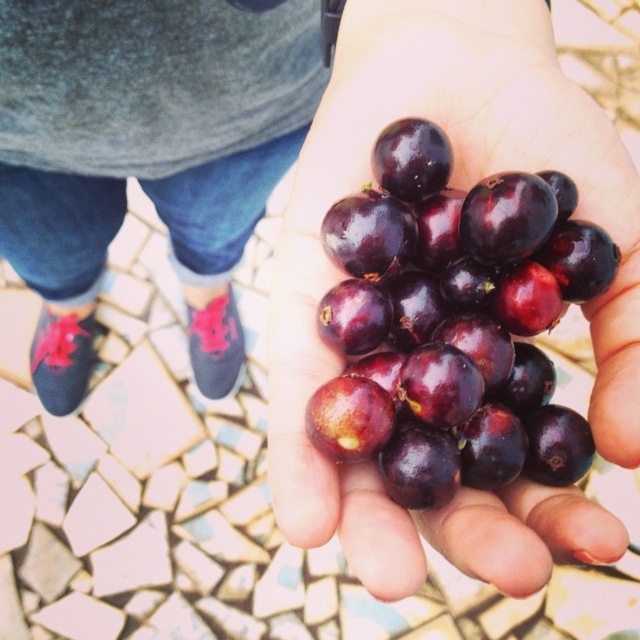
Is point (284, 380) positioned in front of point (64, 161)?

Yes, point (284, 380) is closer to viewer.

Where is `shiny dark purple grapes at center`? shiny dark purple grapes at center is located at coordinates (461, 188).

Does point (620, 413) come farther from viewer compared to point (212, 148)?

That is False.

Locate an element on the screen. This screenshot has width=640, height=640. shiny dark purple grapes at center is located at coordinates (461, 188).